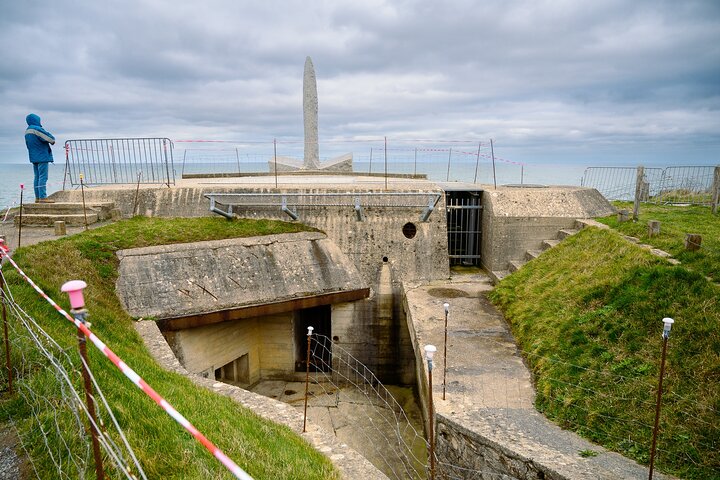
Locate an element on the screen. lower wall brick is located at coordinates (477, 469).